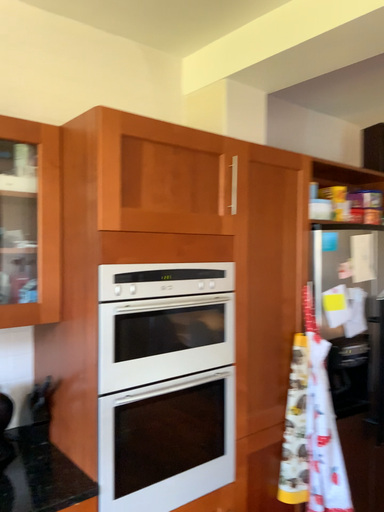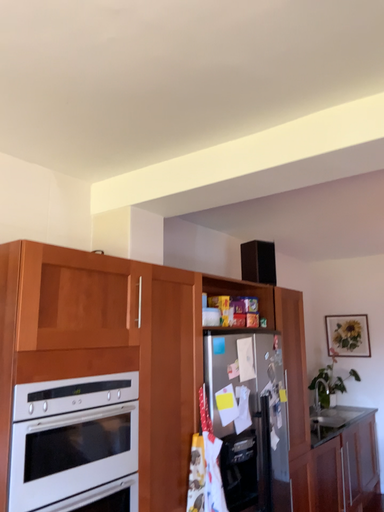
Question: How did the camera likely rotate when shooting the video?

Choices:
 (A) rotated downward
 (B) rotated upward

Answer: (B)